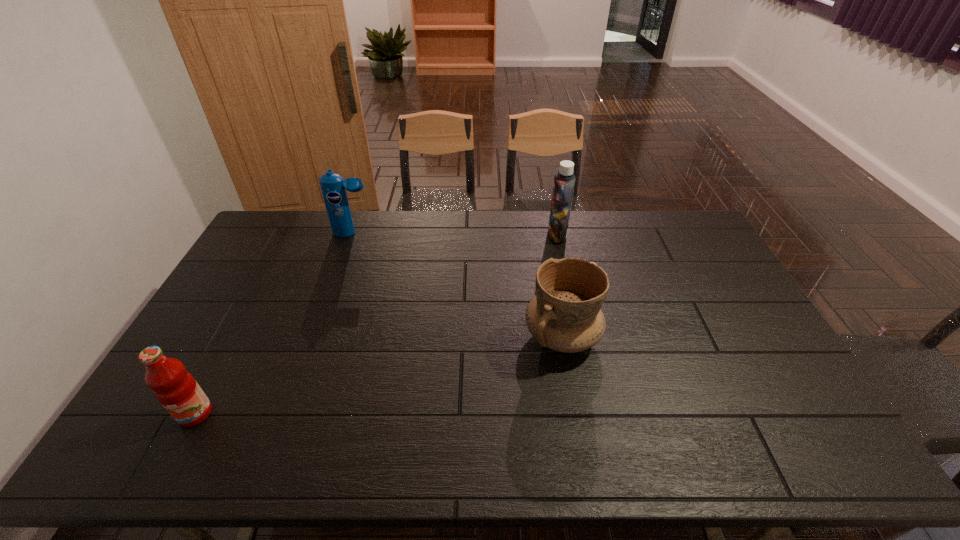
The image size is (960, 540). In order to click on vacant space positioned 0.310m on the back of the pottery in this screenshot , I will do `click(546, 247)`.

Identify the location of object that is positioned at the near edge. click(176, 389).

Image resolution: width=960 pixels, height=540 pixels. What are the coordinates of `object at the left edge` in the screenshot? It's located at (176, 389).

Where is `object situated at the near left corner`? object situated at the near left corner is located at coordinates (176, 389).

Find the location of a particular element. The width and height of the screenshot is (960, 540). free region at the far edge of the desktop is located at coordinates (500, 224).

In the image, there is a desktop. Find the location of `vacant space at the near edge`. vacant space at the near edge is located at coordinates (361, 442).

At what (x,y) coordinates should I click in order to perform the action: click on free space at the left edge. Please return your answer as a coordinate pair (x, y). Looking at the image, I should click on (261, 296).

The width and height of the screenshot is (960, 540). I want to click on vacant region at the right edge of the desktop, so click(x=705, y=291).

You are a GUI agent. You are given a task and a screenshot of the screen. Output one action in this format:
    pyautogui.click(x=<x>, y=<y>)
    Task: Click on the blank space at the far left corner of the desktop
    
    Given the screenshot: What is the action you would take?
    [274, 248]

This screenshot has width=960, height=540. Identify the location of vacant area that lies between the leftmost object and the right shampoo. (376, 324).